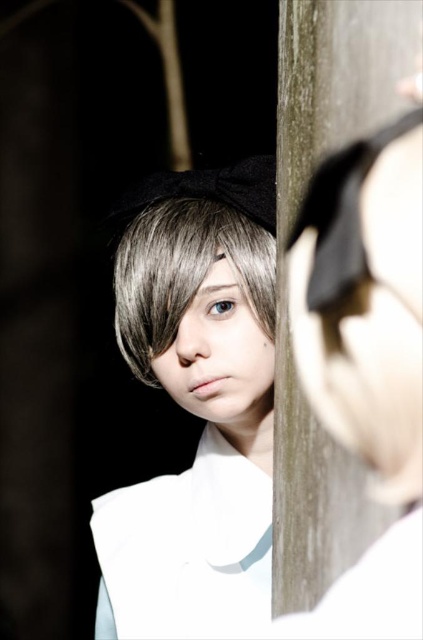
Question: Observing the image, what is the correct spatial positioning of smooth white dress at center in reference to smooth brown hair at center?

Choices:
 (A) left
 (B) right

Answer: (B)

Question: Which object appears closest to the camera in this image?

Choices:
 (A) smooth brown hair at center
 (B) smooth white dress at center

Answer: (B)

Question: Can you confirm if smooth white dress at center is wider than matte gray eye at center?

Choices:
 (A) yes
 (B) no

Answer: (A)

Question: Which point is farther from the camera taking this photo?

Choices:
 (A) (158, 227)
 (B) (230, 312)

Answer: (A)

Question: Does smooth brown hair at center come in front of matte gray eye at center?

Choices:
 (A) no
 (B) yes

Answer: (B)

Question: Which of the following is the closest to the observer?

Choices:
 (A) smooth brown hair at center
 (B) matte gray eye at center

Answer: (A)